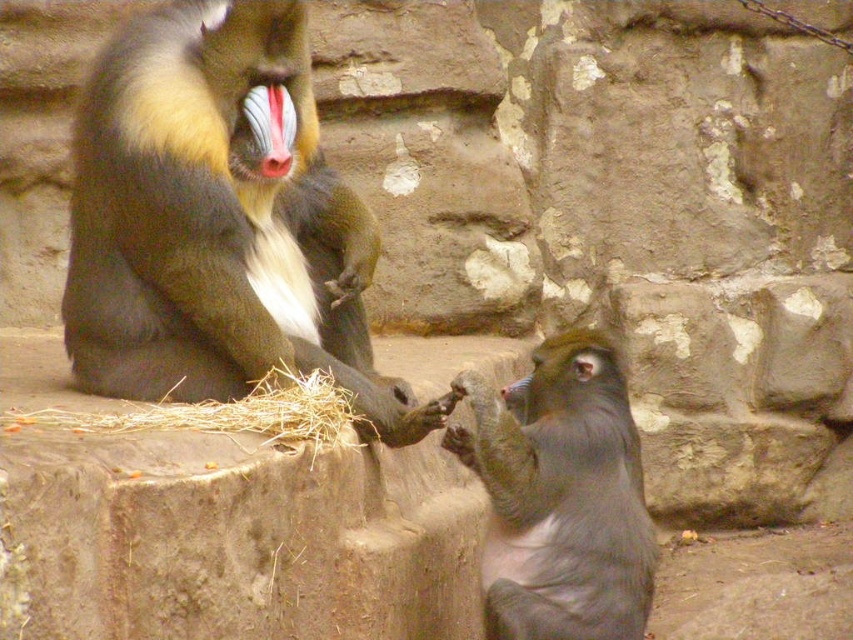
Between point (189, 90) and point (518, 561), which one is positioned in front?

Positioned in front is point (518, 561).

Is shiny fur monkey at upper left taller than gray furry monkey at center?

Yes.

Describe the element at coordinates (218, 220) in the screenshot. This screenshot has width=853, height=640. I see `shiny fur monkey at upper left` at that location.

Identify the location of shiny fur monkey at upper left. The width and height of the screenshot is (853, 640). (218, 220).